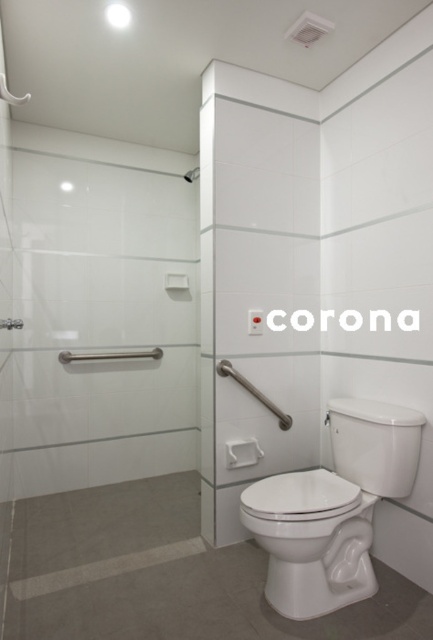
Measure the distance between white glossy toilet at lower right and camera.

They are 1.73 meters apart.

Is point (394, 492) more distant than point (274, 412)?

No, (394, 492) is in front of (274, 412).

This screenshot has height=640, width=433. I want to click on white glossy toilet at lower right, so click(332, 508).

Which is below, white glossy screen door at center or white glossy toilet at lower right?

white glossy toilet at lower right is lower down.

Can you confirm if white glossy screen door at center is wider than white glossy toilet at lower right?

In fact, white glossy screen door at center might be narrower than white glossy toilet at lower right.

Is point (287, 308) positioned after point (397, 444)?

Yes, it is behind point (397, 444).

The image size is (433, 640). Find the location of `white glossy screen door at center`. white glossy screen door at center is located at coordinates (264, 289).

Can you confirm if white glossy screen door at center is taller than satin nickel grab bar at lower center?

Indeed, white glossy screen door at center has a greater height compared to satin nickel grab bar at lower center.

Does white glossy screen door at center appear on the right side of satin nickel grab bar at lower center?

Correct, you'll find white glossy screen door at center to the right of satin nickel grab bar at lower center.

Describe the element at coordinates (264, 289) in the screenshot. I see `white glossy screen door at center` at that location.

The image size is (433, 640). I want to click on white glossy screen door at center, so click(x=264, y=289).